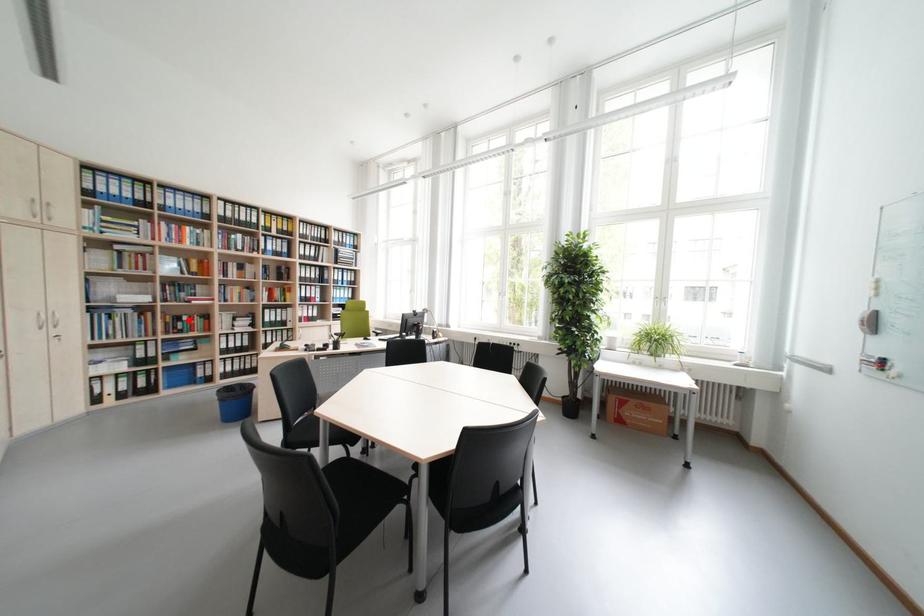
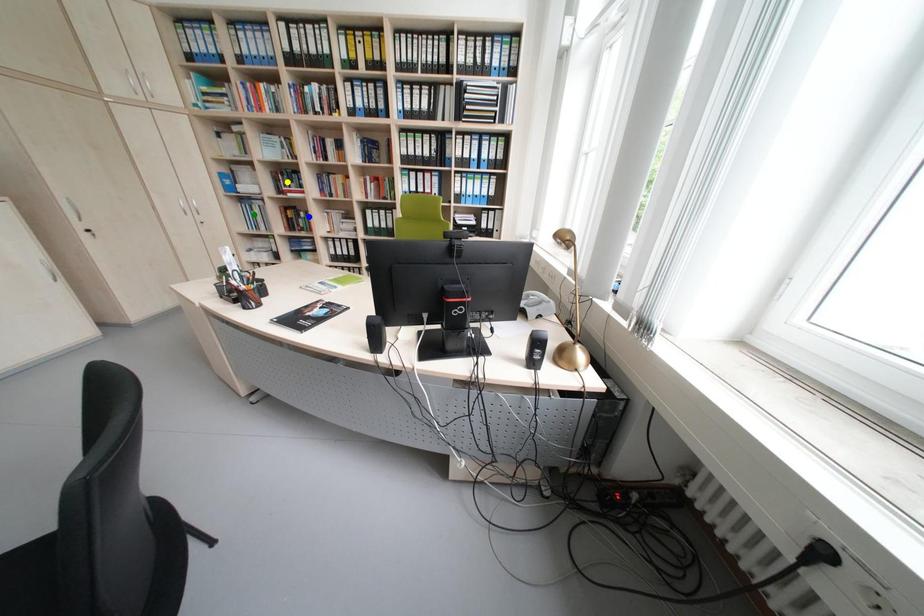
Question: I am providing you with two images of the same scene from different viewpoints. A red point is marked on the first image. You are given multiple points on the second image. In image 2, which mark is for the same physical point as the one in image 1?

Choices:
 (A) yellow point
 (B) blue point
 (C) green point

Answer: (B)